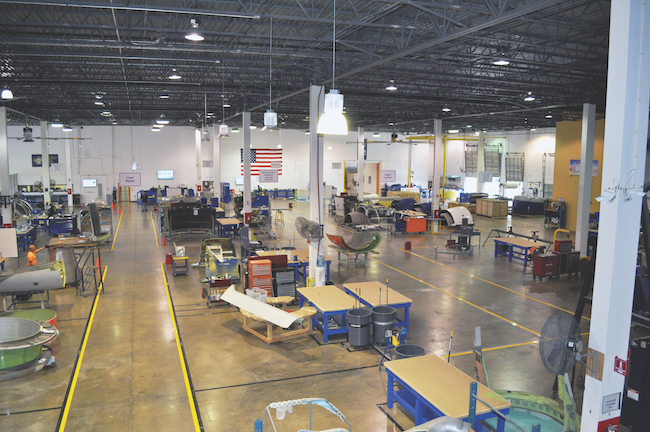
Locate an element on the screen. Image resolution: width=650 pixels, height=432 pixels. light is located at coordinates (201, 42).